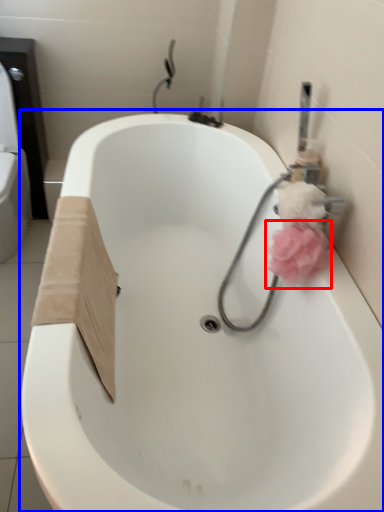
Question: Among these objects, which one is farthest to the camera, flower (highlighted by a red box) or bathtub (highlighted by a blue box)?

Choices:
 (A) flower
 (B) bathtub

Answer: (A)